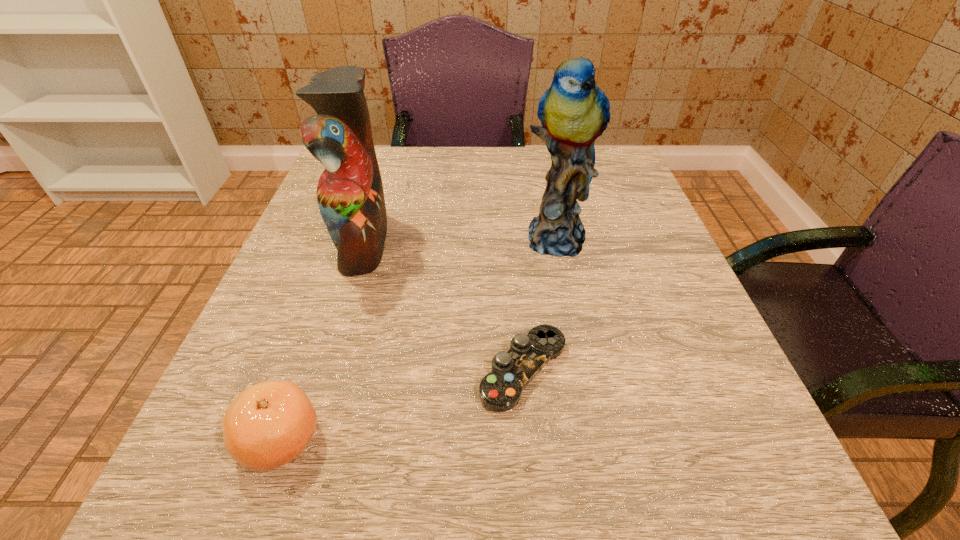
Locate an element on the screen. The width and height of the screenshot is (960, 540). object positioned at the near edge is located at coordinates (269, 424).

Where is `parrot present at the left edge`? The width and height of the screenshot is (960, 540). parrot present at the left edge is located at coordinates (350, 196).

Locate an element on the screen. This screenshot has width=960, height=540. clementine that is at the left edge is located at coordinates (269, 424).

Locate an element on the screen. The width and height of the screenshot is (960, 540). object at the right edge is located at coordinates (574, 112).

I want to click on object that is at the near left corner, so click(x=269, y=424).

Locate an element on the screen. vacant space at the far edge of the desktop is located at coordinates (489, 155).

In the image, there is a desktop. Where is `vacant space at the near edge`? vacant space at the near edge is located at coordinates (382, 453).

Image resolution: width=960 pixels, height=540 pixels. In order to click on free space at the left edge in this screenshot , I will do `click(292, 293)`.

Locate an element on the screen. The width and height of the screenshot is (960, 540). free area in between the shorter parrot and the tallest object is located at coordinates (460, 239).

You are a GUI agent. You are given a task and a screenshot of the screen. Output one action in this format:
    pyautogui.click(x=<x>, y=<y>)
    Task: Click on the free spot between the clementine and the third shortest object
    This screenshot has height=540, width=960.
    Given the screenshot: What is the action you would take?
    pyautogui.click(x=322, y=341)